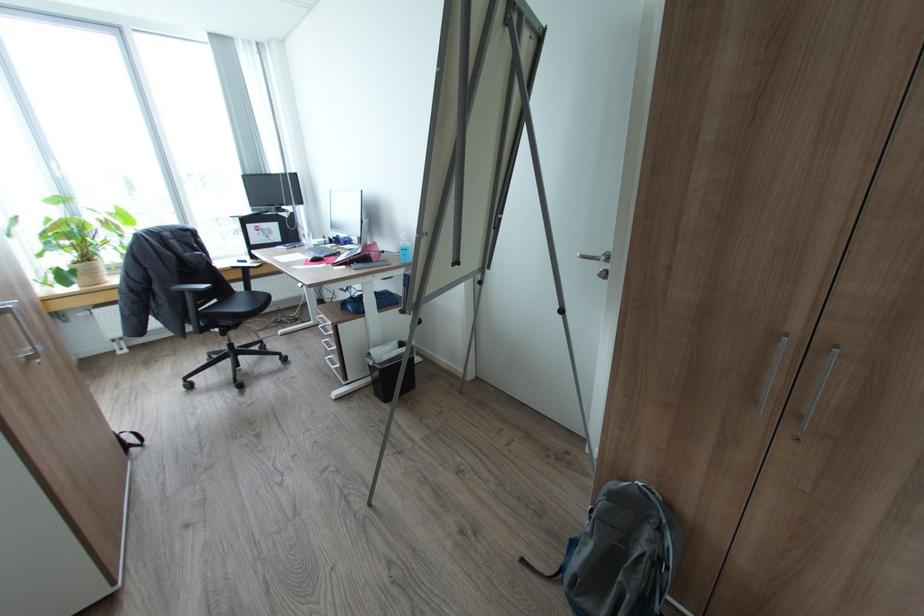
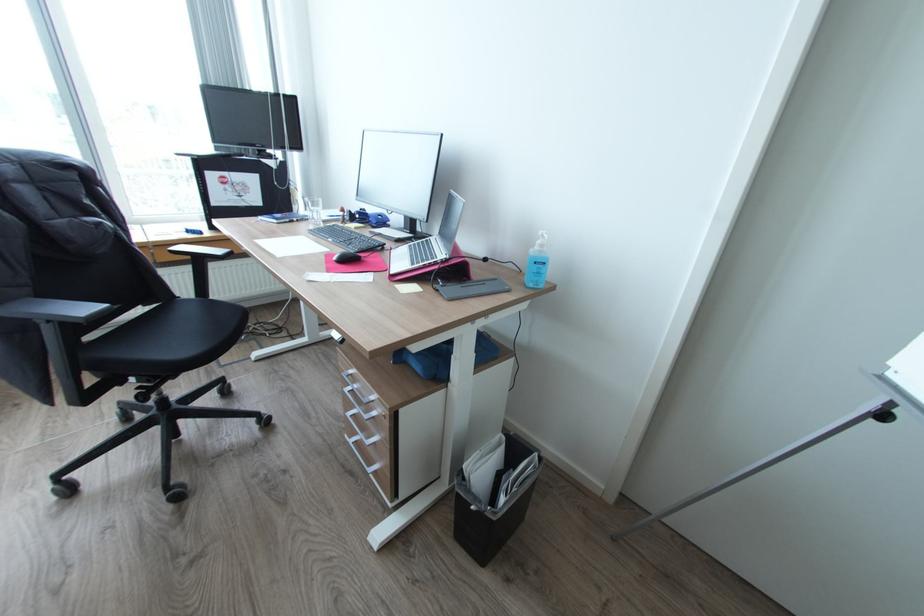
Where in the second image is the point corresponding to (x=338, y=238) from the first image?

(362, 216)